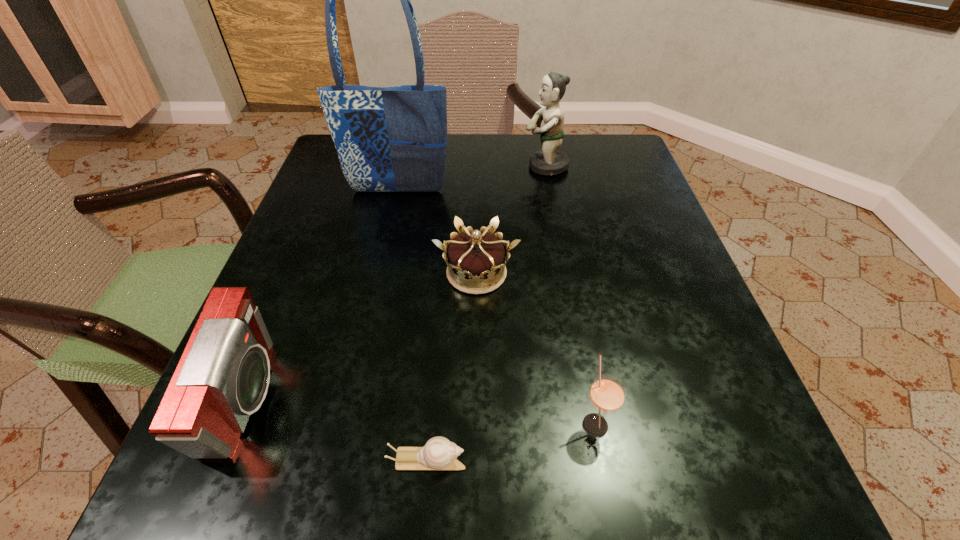
Identify the location of free space located on the front-facing side of the farthest object. The image size is (960, 540). (380, 166).

Locate an element on the screen. The width and height of the screenshot is (960, 540). free space located on the front-facing side of the farthest object is located at coordinates (501, 166).

I want to click on vacant region located on the front-facing side of the farthest object, so click(354, 166).

At what (x,y) coordinates should I click in order to perform the action: click on vacant area situated on the back of the straw. Please return your answer as a coordinate pair (x, y). This screenshot has height=540, width=960. Looking at the image, I should click on (558, 226).

The width and height of the screenshot is (960, 540). I want to click on vacant space situated on the front-facing side of the camera, so click(351, 400).

You are a GUI agent. You are given a task and a screenshot of the screen. Output one action in this format:
    pyautogui.click(x=<x>, y=<y>)
    Task: Click on the vacant region located 0.190m on the back of the second shortest object
    The width and height of the screenshot is (960, 540).
    Given the screenshot: What is the action you would take?
    pyautogui.click(x=477, y=190)

At what (x,y) coordinates should I click in order to perform the action: click on vacant region located on the shell of the escargot. Please return your answer as a coordinate pair (x, y). This screenshot has width=960, height=540. Looking at the image, I should click on (657, 461).

What are the coordinates of `shopping bag located in the far edge section of the desktop` in the screenshot? It's located at (389, 139).

Image resolution: width=960 pixels, height=540 pixels. In order to click on figurine that is at the far edge in this screenshot , I will do `click(549, 161)`.

What are the coordinates of `camera that is at the near edge` in the screenshot? It's located at (223, 375).